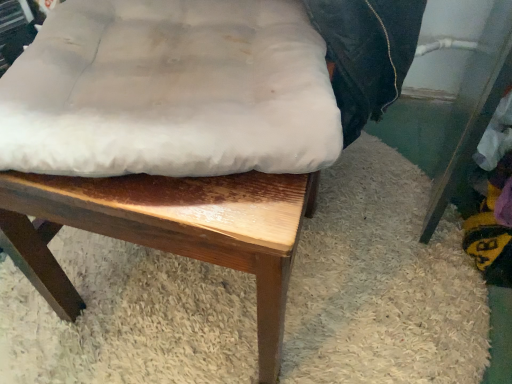
Where is `vacant region below white fabric cushion at center (from a real-world perspective)`? Image resolution: width=512 pixels, height=384 pixels. vacant region below white fabric cushion at center (from a real-world perspective) is located at coordinates (184, 302).